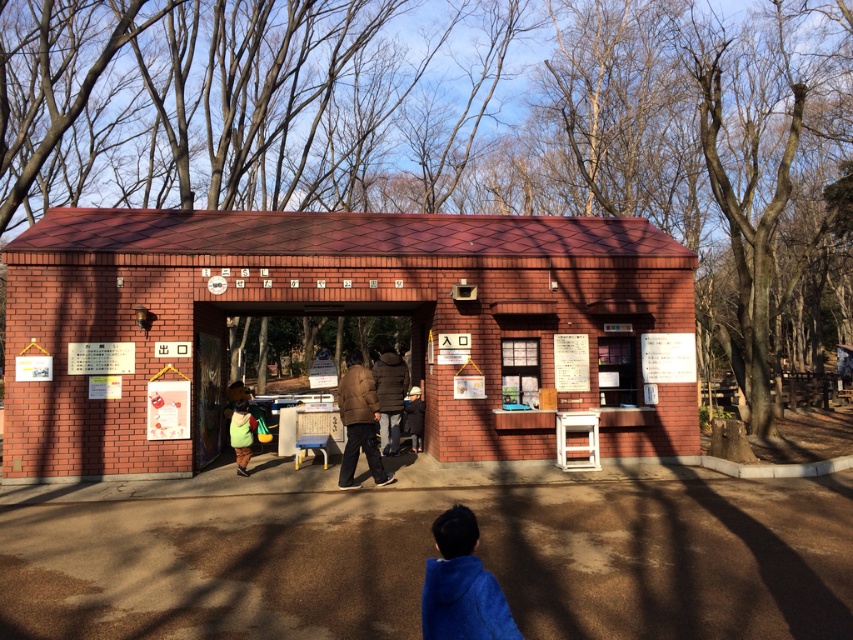
Question: Can you confirm if dark brown fur coat at center is smaller than green fabric backpack at center?

Choices:
 (A) yes
 (B) no

Answer: (B)

Question: Which object appears farthest from the camera in this image?

Choices:
 (A) blue fleece jacket at lower center
 (B) brown fuzzy coat at center
 (C) dark brown fur coat at center
 (D) red brick hut at center

Answer: (C)

Question: Which object is closer to the camera taking this photo?

Choices:
 (A) green fabric backpack at center
 (B) blue fleece jacket at lower center
 (C) red brick hut at center

Answer: (B)

Question: Which of these objects is positioned farthest from the dark brown fur coat at center?

Choices:
 (A) red brick hut at center
 (B) brown fuzzy coat at center
 (C) green fabric backpack at center

Answer: (C)

Question: Can you confirm if red brick hut at center is thinner than brown fuzzy coat at center?

Choices:
 (A) yes
 (B) no

Answer: (B)

Question: Can you confirm if brown fuzzy coat at center is thinner than dark brown fur coat at center?

Choices:
 (A) no
 (B) yes

Answer: (A)